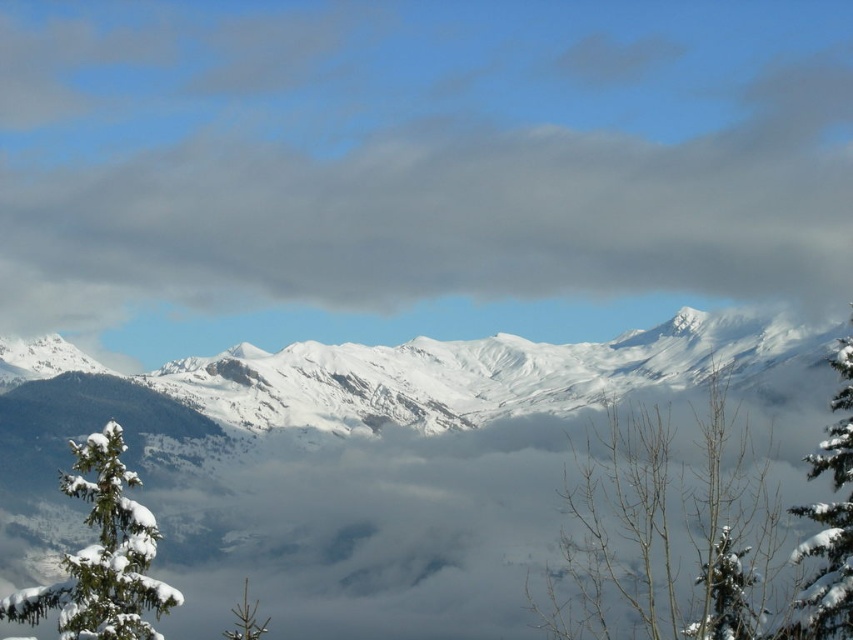
Based on the coordinates provided, what object is located at point (102, 556) in the scene?

The point (102, 556) indicates a white snow covered tree at lower left.

You are standing at the base of the mountain and see the point marked at coordinates point [381,461]. Based on the image, what terrain feature is located at that point?

The point [381,461] is on the white snow covered mountain range at center.